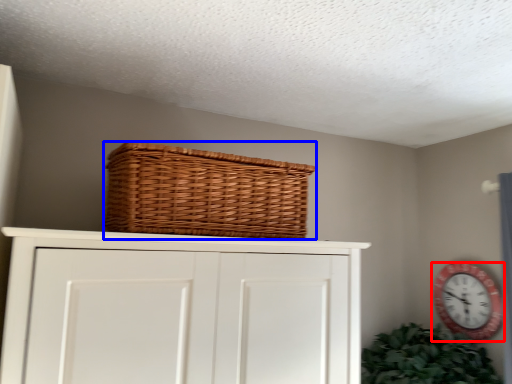
Question: Among these objects, which one is farthest to the camera, wall clock (highlighted by a red box) or basket (highlighted by a blue box)?

Choices:
 (A) wall clock
 (B) basket

Answer: (A)